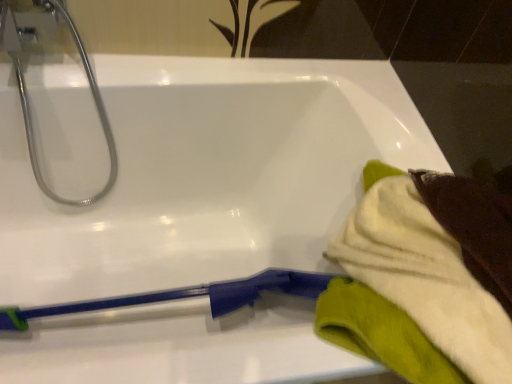
Question: Is white soft towel at right positioned in front of silver metallic tap at upper left?

Choices:
 (A) no
 (B) yes

Answer: (B)

Question: From the image's perspective, is white soft towel at right on top of silver metallic tap at upper left?

Choices:
 (A) yes
 (B) no

Answer: (B)

Question: Is the surface of white soft towel at right in direct contact with silver metallic tap at upper left?

Choices:
 (A) no
 (B) yes

Answer: (A)

Question: Is white soft towel at right far away from silver metallic tap at upper left?

Choices:
 (A) yes
 (B) no

Answer: (B)

Question: Does white soft towel at right have a smaller size compared to silver metallic tap at upper left?

Choices:
 (A) yes
 (B) no

Answer: (A)

Question: Is white soft towel at right taller than silver metallic tap at upper left?

Choices:
 (A) yes
 (B) no

Answer: (B)

Question: Is silver metallic tap at upper left at the right side of white soft towel at right?

Choices:
 (A) no
 (B) yes

Answer: (A)

Question: Considering the relative sizes of silver metallic tap at upper left and white soft towel at right in the image provided, is silver metallic tap at upper left thinner than white soft towel at right?

Choices:
 (A) yes
 (B) no

Answer: (A)

Question: Can you confirm if silver metallic tap at upper left is bigger than white soft towel at right?

Choices:
 (A) yes
 (B) no

Answer: (A)

Question: Is silver metallic tap at upper left aimed at white soft towel at right?

Choices:
 (A) yes
 (B) no

Answer: (B)

Question: From a real-world perspective, is silver metallic tap at upper left positioned over white soft towel at right based on gravity?

Choices:
 (A) yes
 (B) no

Answer: (B)

Question: Is silver metallic tap at upper left next to white soft towel at right and touching it?

Choices:
 (A) yes
 (B) no

Answer: (B)

Question: From the image's perspective, is silver metallic tap at upper left positioned above or below white soft towel at right?

Choices:
 (A) above
 (B) below

Answer: (A)